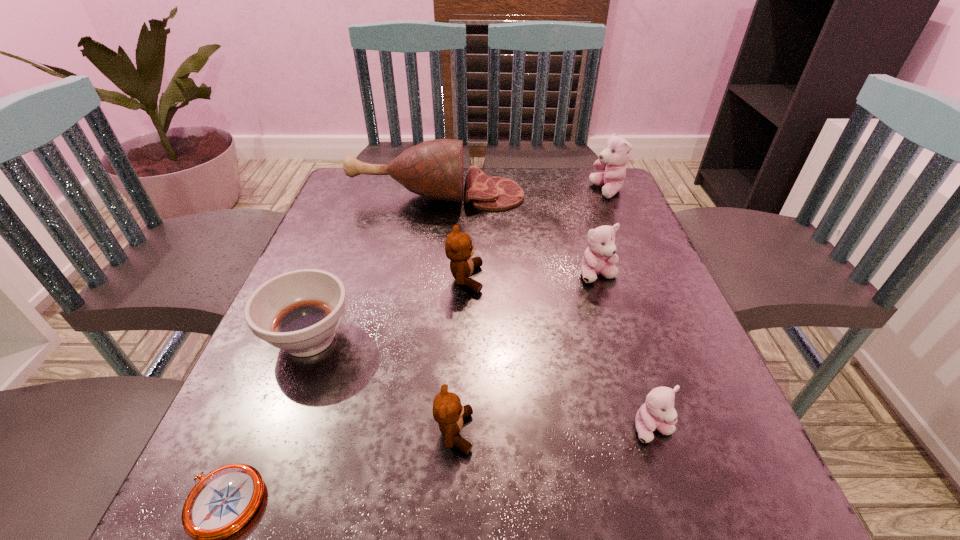
At what (x,y) coordinates should I click in order to perform the action: click on soup bowl positioned at the left edge. Please return your answer as a coordinate pair (x, y). Looking at the image, I should click on (299, 311).

This screenshot has height=540, width=960. In order to click on object located in the far left corner section of the desktop in this screenshot , I will do `click(433, 169)`.

Where is `object that is at the far right corner`? The width and height of the screenshot is (960, 540). object that is at the far right corner is located at coordinates tap(616, 154).

The image size is (960, 540). I want to click on vacant space at the far edge of the desktop, so click(558, 207).

Identify the location of free space at the left edge. The image size is (960, 540). (365, 249).

You are a GUI agent. You are given a task and a screenshot of the screen. Output one action in this format:
    pyautogui.click(x=<x>, y=<y>)
    Task: Click on the blank area at the right edge
    
    Given the screenshot: What is the action you would take?
    pyautogui.click(x=664, y=370)

In the image, there is a desktop. Where is `vacant area at the far left corner`? vacant area at the far left corner is located at coordinates pos(334,200).

Where is `empty space that is in between the ham and the fourth nearest object`? The height and width of the screenshot is (540, 960). empty space that is in between the ham and the fourth nearest object is located at coordinates (373, 266).

Identify the location of vacant area that lies between the bigger brown teddy bear and the smallest pink teddy bear. The width and height of the screenshot is (960, 540). (559, 354).

The image size is (960, 540). I want to click on free area in between the ham and the smallest pink teddy bear, so click(545, 312).